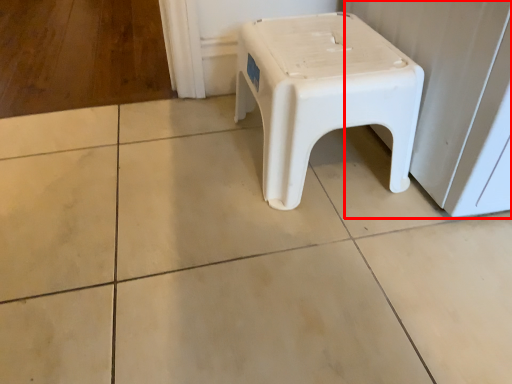
Question: From the image's perspective, what is the correct spatial relationship of screen door (annotated by the red box) in relation to stool?

Choices:
 (A) above
 (B) below

Answer: (A)